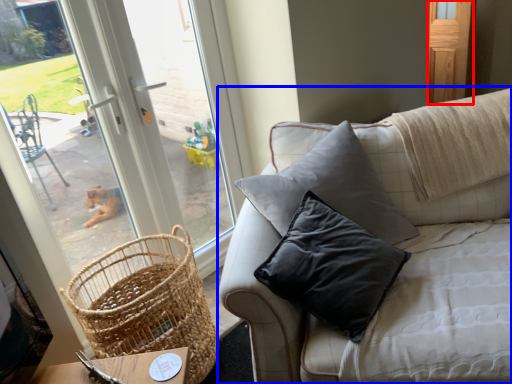
Question: Among these objects, which one is farthest to the camera, screen door (highlighted by a red box) or studio couch (highlighted by a blue box)?

Choices:
 (A) screen door
 (B) studio couch

Answer: (A)